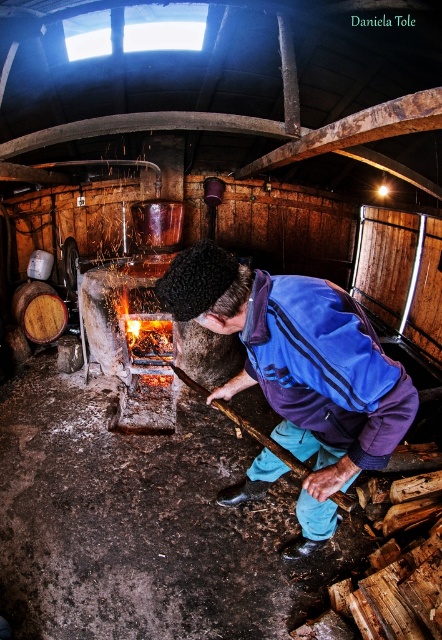
Question: Which point appears closest to the camera in this image?

Choices:
 (A) (384, 353)
 (B) (49, 291)

Answer: (A)

Question: Observing the image, what is the correct spatial positioning of blue fleece jacket at center in reference to wooden barrel at left?

Choices:
 (A) right
 (B) left

Answer: (A)

Question: Does blue fleece jacket at center lie behind wooden barrel at left?

Choices:
 (A) no
 (B) yes

Answer: (A)

Question: Which point is closer to the camera?

Choices:
 (A) (224, 504)
 (B) (18, 301)

Answer: (A)

Question: Is blue fleece jacket at center to the left of wooden barrel at left from the viewer's perspective?

Choices:
 (A) yes
 (B) no

Answer: (B)